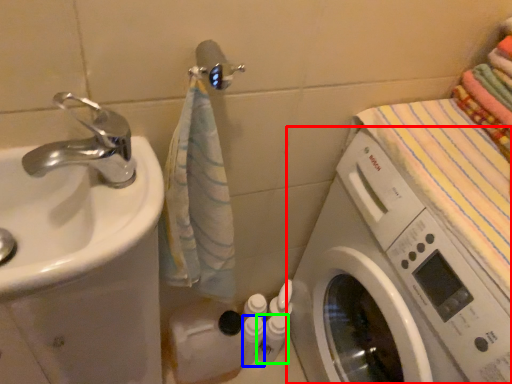
Question: Which is nearer to the washing machine (highlighted by a red box)? toiletry (highlighted by a blue box) or toiletry (highlighted by a green box).

Choices:
 (A) toiletry
 (B) toiletry

Answer: (B)